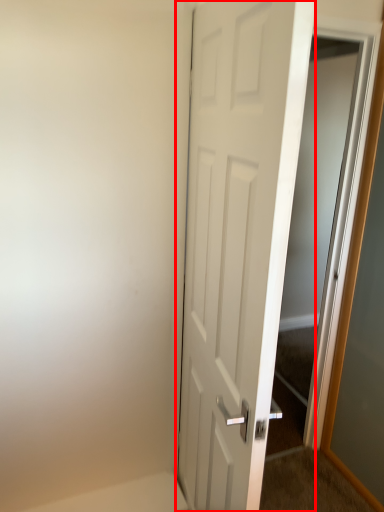
Question: From the image's perspective, what is the correct spatial positioning of door (annotated by the red box) in reference to elevator?

Choices:
 (A) below
 (B) above

Answer: (A)